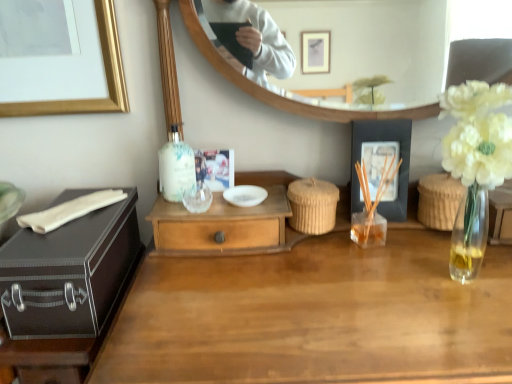
Question: Is translucent glass bottle at upper center inside wooden desk at center?

Choices:
 (A) no
 (B) yes

Answer: (A)

Question: From the image's perspective, does wooden desk at center appear lower than translucent glass bottle at upper center?

Choices:
 (A) no
 (B) yes

Answer: (B)

Question: Considering the relative sizes of wooden desk at center and translucent glass bottle at upper center in the image provided, is wooden desk at center thinner than translucent glass bottle at upper center?

Choices:
 (A) yes
 (B) no

Answer: (B)

Question: From the image's perspective, is wooden desk at center on top of translucent glass bottle at upper center?

Choices:
 (A) yes
 (B) no

Answer: (B)

Question: Is wooden desk at center with translucent glass bottle at upper center?

Choices:
 (A) no
 (B) yes

Answer: (A)

Question: Does wooden desk at center have a smaller size compared to translucent glass bottle at upper center?

Choices:
 (A) yes
 (B) no

Answer: (B)

Question: Is translucent glass bottle at upper center positioned before wooden drawer at center?

Choices:
 (A) yes
 (B) no

Answer: (B)

Question: From a real-world perspective, is translucent glass bottle at upper center under wooden drawer at center?

Choices:
 (A) yes
 (B) no

Answer: (B)

Question: Is translucent glass bottle at upper center positioned far away from wooden drawer at center?

Choices:
 (A) no
 (B) yes

Answer: (A)

Question: Does translucent glass bottle at upper center have a lesser height compared to wooden drawer at center?

Choices:
 (A) yes
 (B) no

Answer: (B)

Question: Is wooden drawer at center inside translucent glass bottle at upper center?

Choices:
 (A) yes
 (B) no

Answer: (B)

Question: Is translucent glass bottle at upper center outside wooden drawer at center?

Choices:
 (A) no
 (B) yes

Answer: (B)

Question: Does matte black suitcase at left have a smaller size compared to white glossy bowl at center?

Choices:
 (A) no
 (B) yes

Answer: (A)